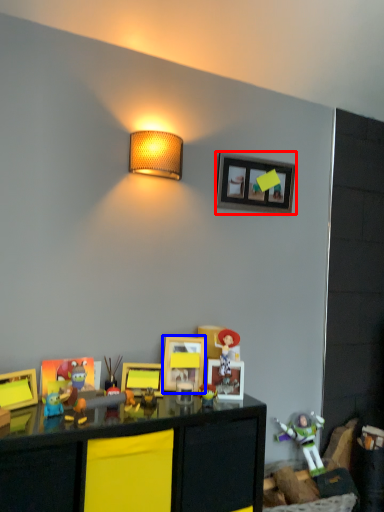
Question: Which of the following is the closest to the observer, picture frame (highlighted by a red box) or picture frame (highlighted by a blue box)?

Choices:
 (A) picture frame
 (B) picture frame

Answer: (B)